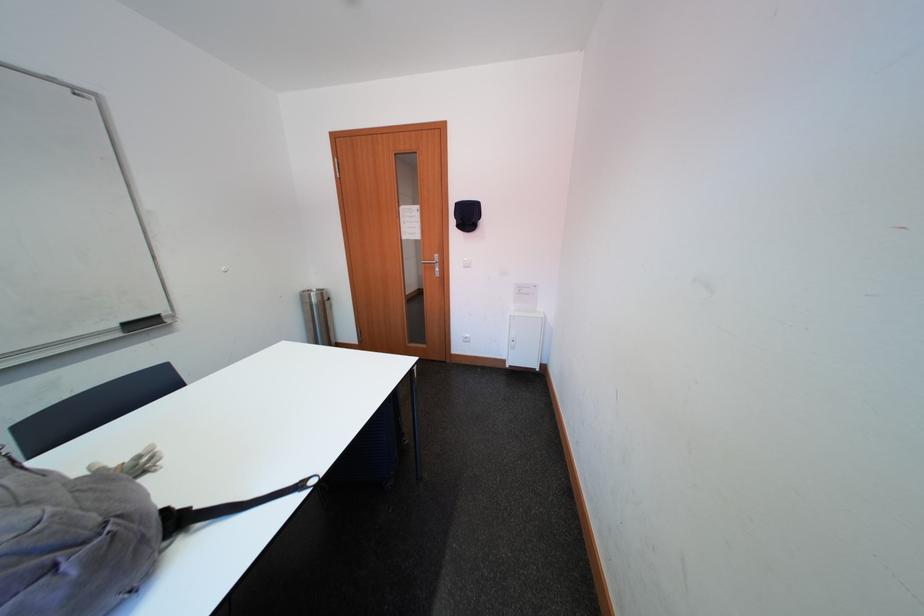
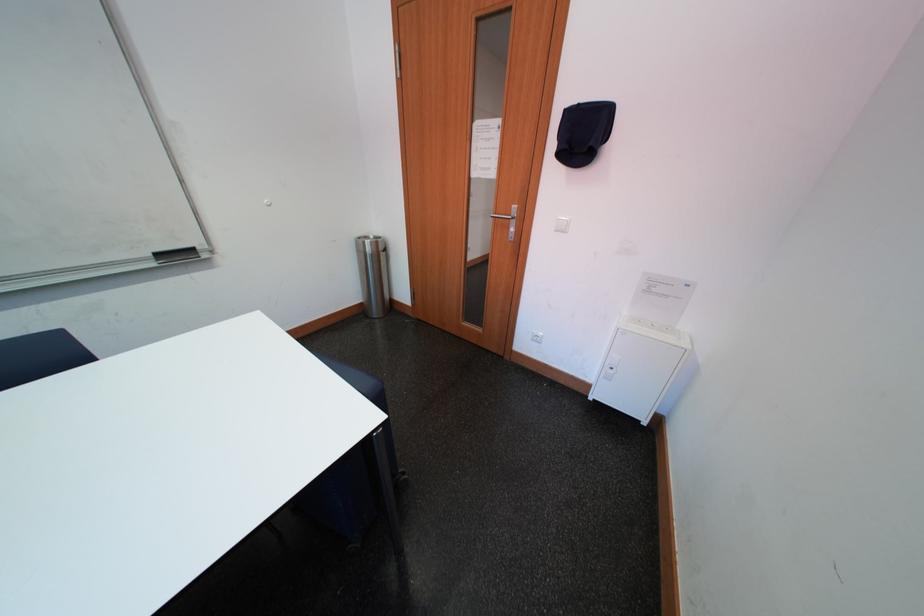
Where in the second image is the point corresponding to [134,328] from the first image?

(167, 257)